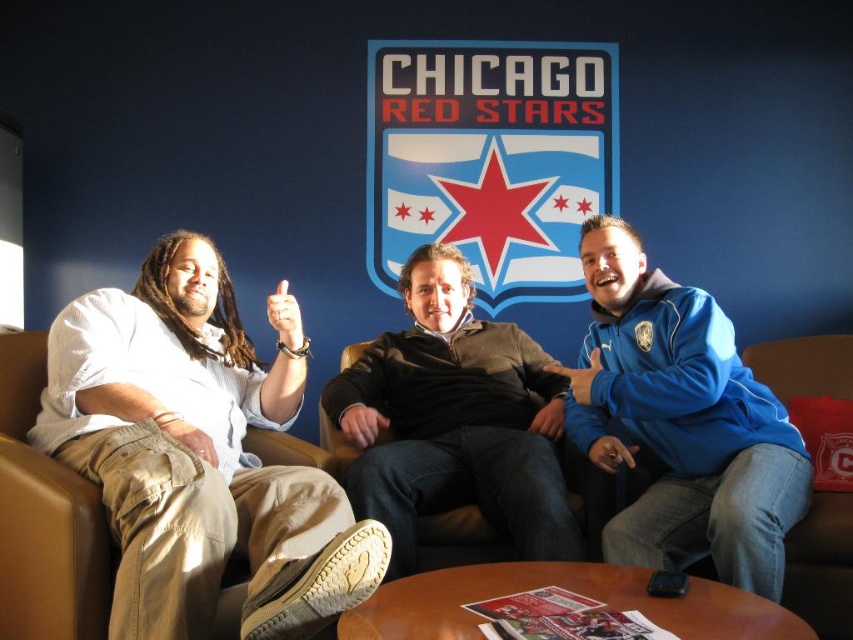
Question: Among these points, which one is farthest from the camera?

Choices:
 (A) click(103, 360)
 (B) click(833, 387)

Answer: (B)

Question: Which object is the farthest from the brown leather couch at center?

Choices:
 (A) blue fleece jacket at right
 (B) dark brown sweater at center
 (C) khaki cotton pants at left

Answer: (A)

Question: Can you confirm if khaki cotton pants at left is positioned below blue fleece jacket at right?

Choices:
 (A) yes
 (B) no

Answer: (A)

Question: Which is nearer to the dark brown sweater at center?

Choices:
 (A) blue fleece jacket at right
 (B) brown leather couch at center
 (C) khaki cotton pants at left

Answer: (A)

Question: Does dark brown sweater at center appear on the left side of brown leather couch at center?

Choices:
 (A) yes
 (B) no

Answer: (B)

Question: Where is khaki cotton pants at left located in relation to dark brown sweater at center in the image?

Choices:
 (A) above
 (B) below

Answer: (B)